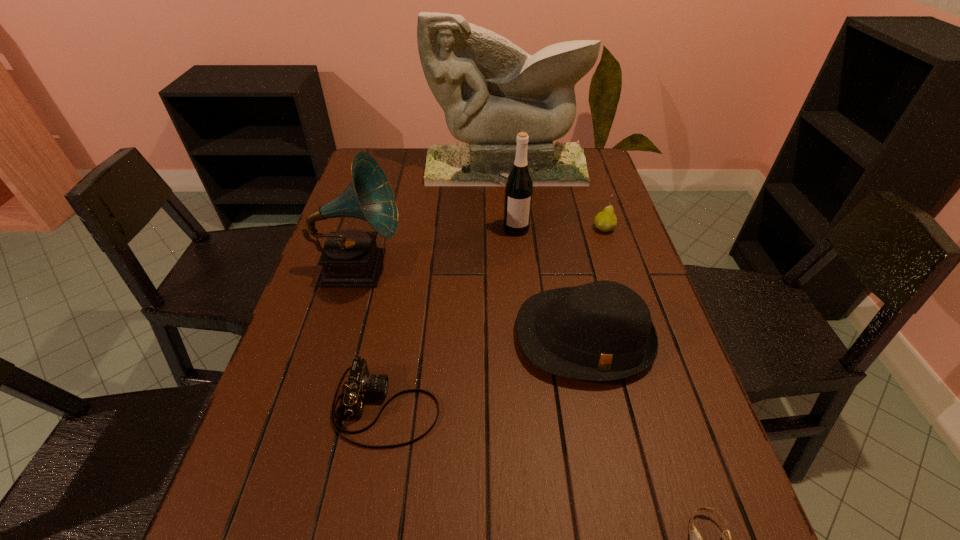
Where is `object that is the second closest to the pear`? The height and width of the screenshot is (540, 960). object that is the second closest to the pear is located at coordinates (490, 89).

At what (x,y) coordinates should I click in order to perform the action: click on object that ranks as the closest to the tallest object. Please return your answer as a coordinate pair (x, y). The image size is (960, 540). Looking at the image, I should click on (519, 186).

What are the coordinates of `vacant region that satisfies the following two spatial constraints: 1. on the label of the wine bottle; 2. on the front-facing side of the camera` in the screenshot? It's located at (534, 407).

What are the coordinates of `vacant area that satisfies the following two spatial constraints: 1. on the label of the wine bottle; 2. on the front-facing side of the camera` in the screenshot? It's located at (534, 407).

At what (x,y) coordinates should I click in order to perform the action: click on free space that satisfies the following two spatial constraints: 1. on the base of the farthest object; 2. on the front-facing side of the camera. Please return your answer as a coordinate pair (x, y). The height and width of the screenshot is (540, 960). Looking at the image, I should click on (524, 407).

The width and height of the screenshot is (960, 540). I want to click on blank area in the image that satisfies the following two spatial constraints: 1. on the base of the sculpture; 2. on the front-facing side of the second shortest object, so click(524, 407).